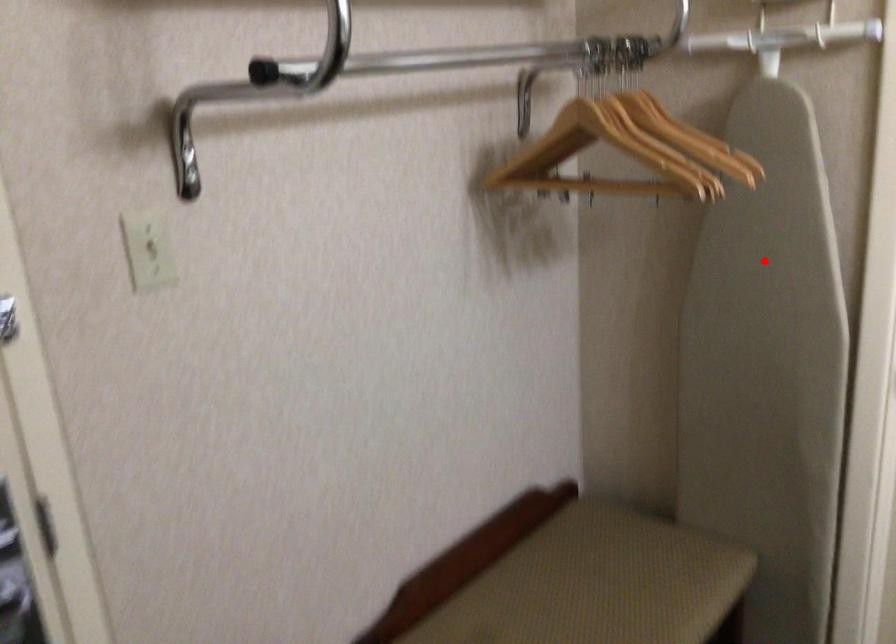
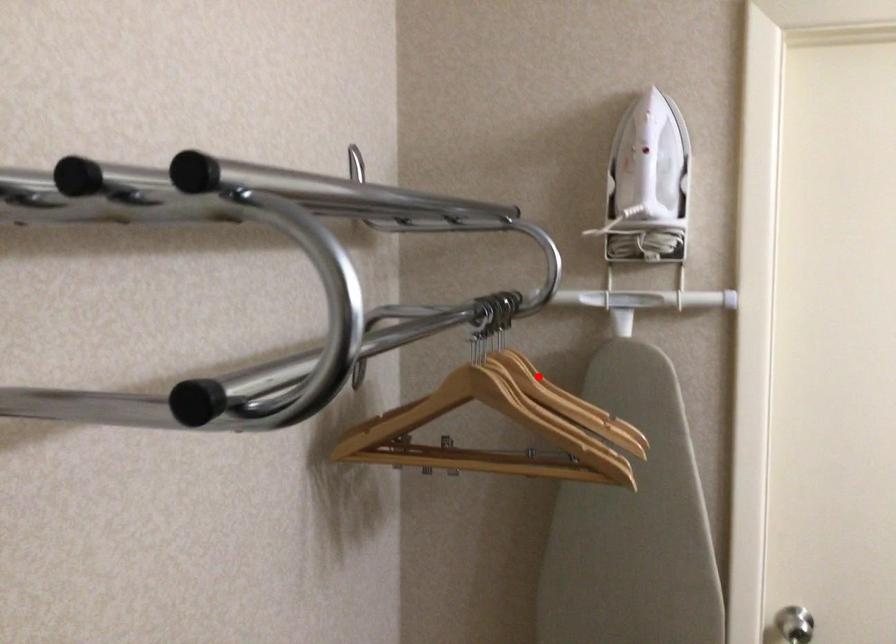
I am providing you with two images of the same scene from different viewpoints. A red point is marked on the first image and another point is marked on the second image. Does the point marked in image1 correspond to the same location as the one in image2?

No